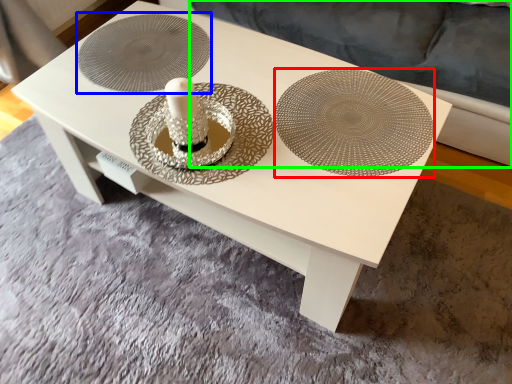
Question: Estimate the real-world distances between objects in this image. Which object is closer to plate (highlighted by a red box), circle (highlighted by a blue box) or couch (highlighted by a green box)?

Choices:
 (A) circle
 (B) couch

Answer: (A)